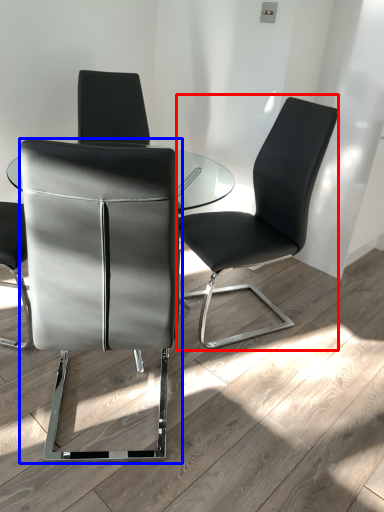
Question: Which object appears closest to the camera in this image, chair (highlighted by a red box) or chair (highlighted by a blue box)?

Choices:
 (A) chair
 (B) chair

Answer: (B)